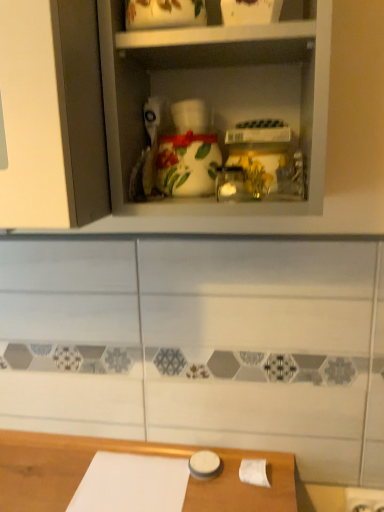
Question: Relative to white glossy vase at center, is white paper at lower right in front or behind?

Choices:
 (A) behind
 (B) front

Answer: (A)

Question: In terms of height, does white paper at lower right look taller or shorter compared to white glossy vase at center?

Choices:
 (A) tall
 (B) short

Answer: (B)

Question: Is white paper at lower right situated inside white glossy vase at center or outside?

Choices:
 (A) outside
 (B) inside

Answer: (A)

Question: From the image's perspective, is white glossy vase at center located above or below white paper at lower right?

Choices:
 (A) above
 (B) below

Answer: (A)

Question: Considering the positions of white glossy vase at center and white paper at lower right in the image, is white glossy vase at center wider or thinner than white paper at lower right?

Choices:
 (A) thin
 (B) wide

Answer: (B)

Question: Relative to white paper at lower right, is white glossy vase at center in front or behind?

Choices:
 (A) front
 (B) behind

Answer: (A)

Question: From a real-world perspective, is white glossy vase at center physically located above or below white paper at lower right?

Choices:
 (A) below
 (B) above

Answer: (B)